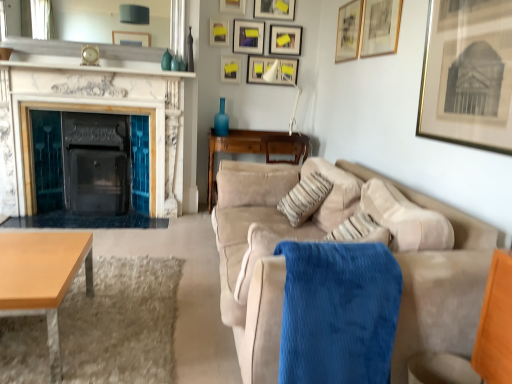
Question: Can you confirm if beige fabric pillow at center is smaller than light brown wooden coffee table at lower left?

Choices:
 (A) no
 (B) yes

Answer: (B)

Question: Does beige fabric pillow at center have a lesser width compared to light brown wooden coffee table at lower left?

Choices:
 (A) yes
 (B) no

Answer: (A)

Question: Is the depth of beige fabric pillow at center less than that of light brown wooden coffee table at lower left?

Choices:
 (A) yes
 (B) no

Answer: (B)

Question: From the image's perspective, does beige fabric pillow at center appear higher than light brown wooden coffee table at lower left?

Choices:
 (A) no
 (B) yes

Answer: (B)

Question: Would you say beige fabric pillow at center contains light brown wooden coffee table at lower left?

Choices:
 (A) yes
 (B) no

Answer: (B)

Question: From their relative heights in the image, would you say matte white picture frame at upper center, arranged as the fourth picture frame when viewed from the back, is taller or shorter than gold-framed print at upper right, which is counted as the 10th picture frame, starting from the back?

Choices:
 (A) short
 (B) tall

Answer: (A)

Question: In the image, is matte white picture frame at upper center, arranged as the fourth picture frame when viewed from the back, positioned in front of or behind gold-framed print at upper right, which is counted as the 10th picture frame, starting from the back?

Choices:
 (A) front
 (B) behind

Answer: (B)

Question: Is matte white picture frame at upper center, the seventh picture frame when ordered from front to back, bigger or smaller than gold-framed print at upper right, the first picture frame from the front?

Choices:
 (A) small
 (B) big

Answer: (A)

Question: Is matte white picture frame at upper center, arranged as the fourth picture frame when viewed from the back, wider or thinner than gold-framed print at upper right, the first picture frame from the front?

Choices:
 (A) wide
 (B) thin

Answer: (B)

Question: In terms of size, does blue corduroy blanket at center appear bigger or smaller than matte white picture frame at upper center, the seventh picture frame when ordered from front to back?

Choices:
 (A) small
 (B) big

Answer: (B)

Question: Is blue corduroy blanket at center wider or thinner than matte white picture frame at upper center, the seventh picture frame when ordered from front to back?

Choices:
 (A) wide
 (B) thin

Answer: (A)

Question: In terms of height, does blue corduroy blanket at center look taller or shorter compared to matte white picture frame at upper center, the seventh picture frame when ordered from front to back?

Choices:
 (A) short
 (B) tall

Answer: (B)

Question: Is blue corduroy blanket at center inside or outside of matte white picture frame at upper center, the seventh picture frame when ordered from front to back?

Choices:
 (A) inside
 (B) outside

Answer: (B)

Question: Based on their sizes in the image, would you say matte white picture frame at upper center, the seventh picture frame when ordered from front to back, is bigger or smaller than blue glass vase at center, positioned as the first vase in right-to-left order?

Choices:
 (A) big
 (B) small

Answer: (B)

Question: Considering the positions of matte white picture frame at upper center, the seventh picture frame when ordered from front to back, and blue glass vase at center, positioned as the first vase in right-to-left order, in the image, is matte white picture frame at upper center, the seventh picture frame when ordered from front to back, taller or shorter than blue glass vase at center, positioned as the first vase in right-to-left order,?

Choices:
 (A) short
 (B) tall

Answer: (A)